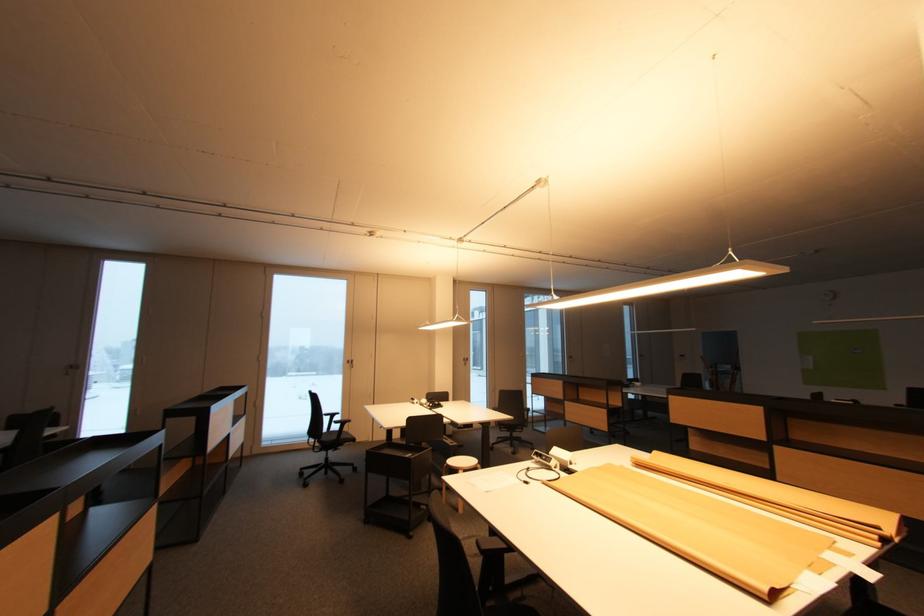
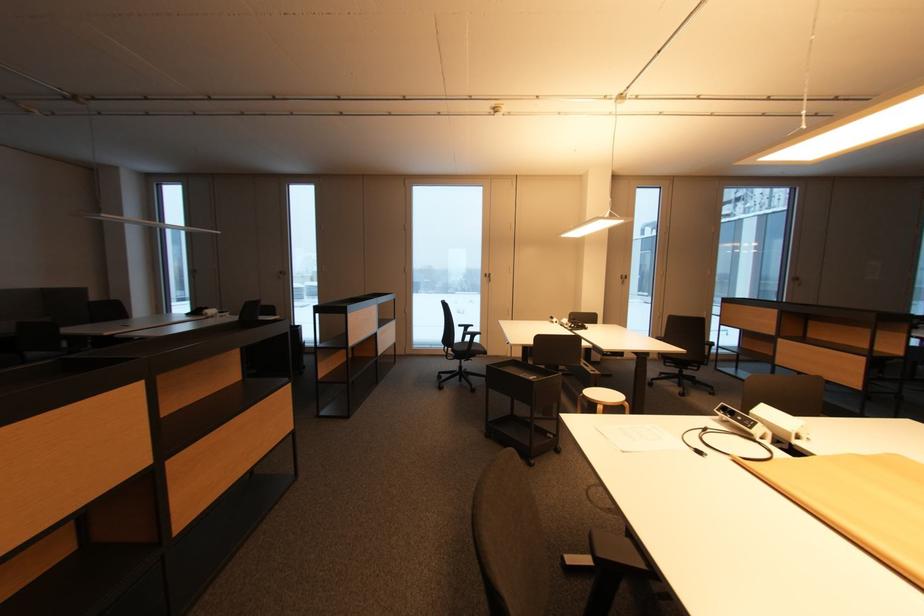
Question: The camera is either moving clockwise (left) or counter-clockwise (right) around the object. The first image is from the beginning of the video and the second image is from the end. Is the camera moving left or right when shooting the video?

Choices:
 (A) Left
 (B) Right

Answer: (B)